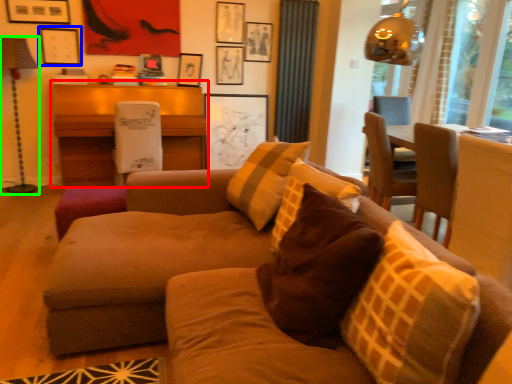
Question: Considering the real-world distances, which object is farthest from table (highlighted by a red box)? picture frame (highlighted by a blue box) or lamp (highlighted by a green box)?

Choices:
 (A) picture frame
 (B) lamp

Answer: (B)